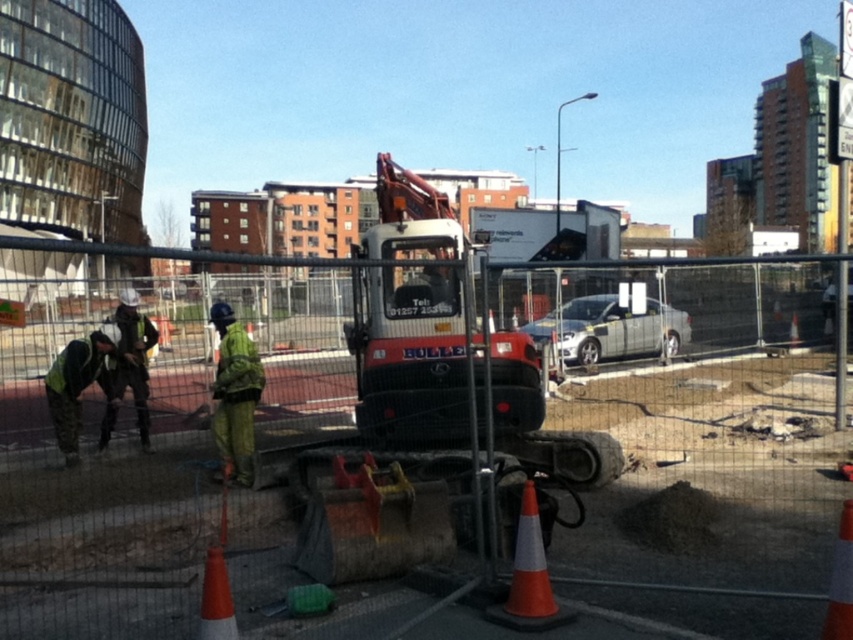
You are a delivery person approaching the construction site. You see the reflective yellow safety vest at lower left. Where should you avoid walking to stay safe?

You should avoid walking near the reflective yellow safety vest at lower left because it is located at point (x=76, y=387), which is close to the active construction area with the BOMAG compactor and fenced off zone.

Based on the photo, you are standing at the viewer position in the construction site. There is a point at coordinates point (x=96, y=333). Can you reach that point without moving more than 20 feet? Please answer yes or no.

The distance between you and point (x=96, y=333) is 25.81 feet, which is more than 20 feet. So the answer is no.